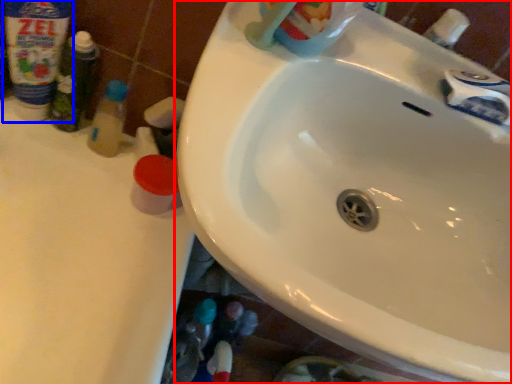
Question: Among these objects, which one is nearest to the camera, sink (highlighted by a red box) or cleaning product (highlighted by a blue box)?

Choices:
 (A) sink
 (B) cleaning product

Answer: (A)